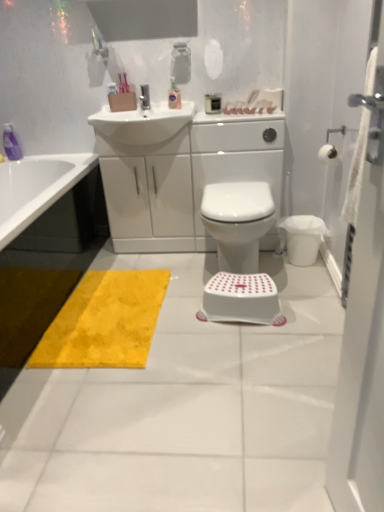
The width and height of the screenshot is (384, 512). Identify the location of empty space that is in between white plastic step stool at center and yellow fuzzy rug at lower left. (195, 321).